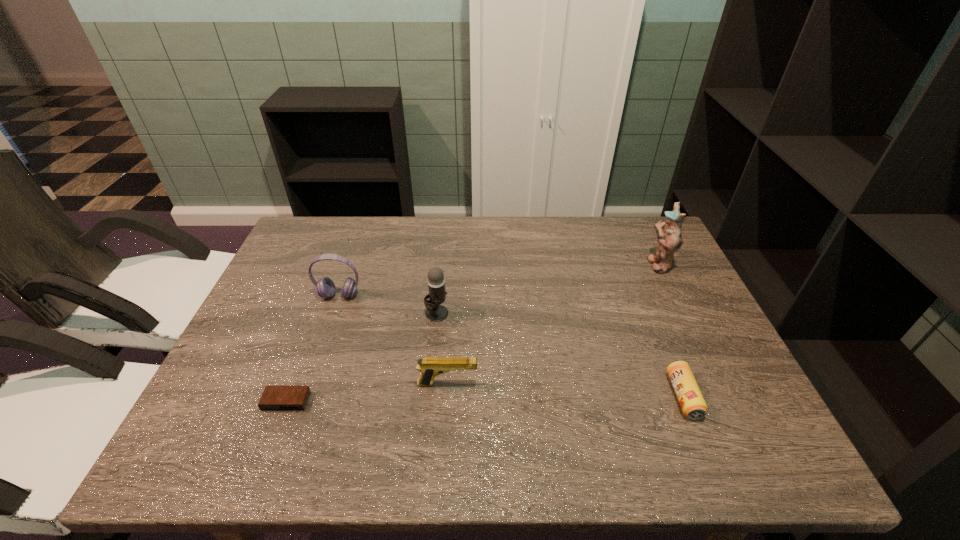
I want to click on vacant space that satisfies the following two spatial constraints: 1. at the barrel of the pistol; 2. on the right side of the fifth object from left to right, so click(x=447, y=396).

Identify the location of free space in the image that satisfies the following two spatial constraints: 1. at the barrel of the fifth tallest object; 2. on the left side of the third shortest object. This screenshot has width=960, height=540. (447, 396).

Identify the location of free space that satisfies the following two spatial constraints: 1. on the headband and ear cups of the beer can; 2. on the right side of the second farthest object. (304, 396).